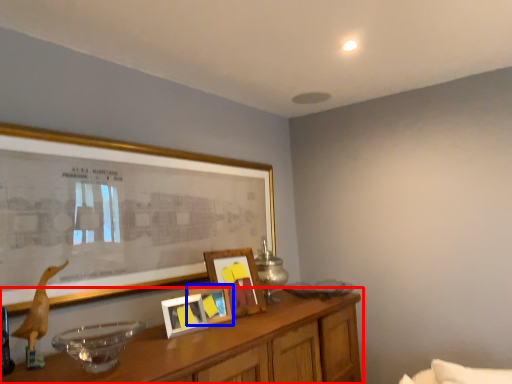
Question: Which object is further to the camera taking this photo, table (highlighted by a red box) or picture frame (highlighted by a blue box)?

Choices:
 (A) table
 (B) picture frame

Answer: (B)